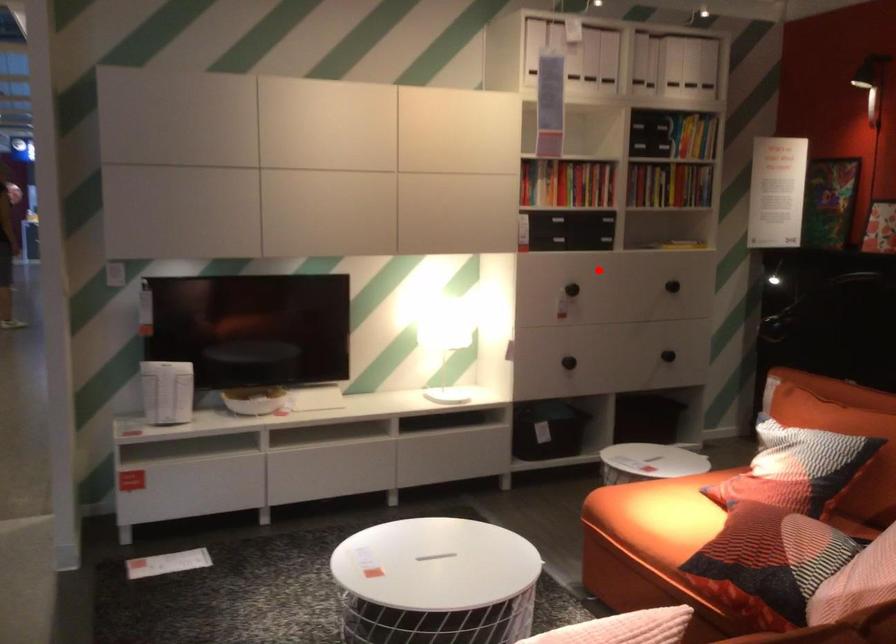
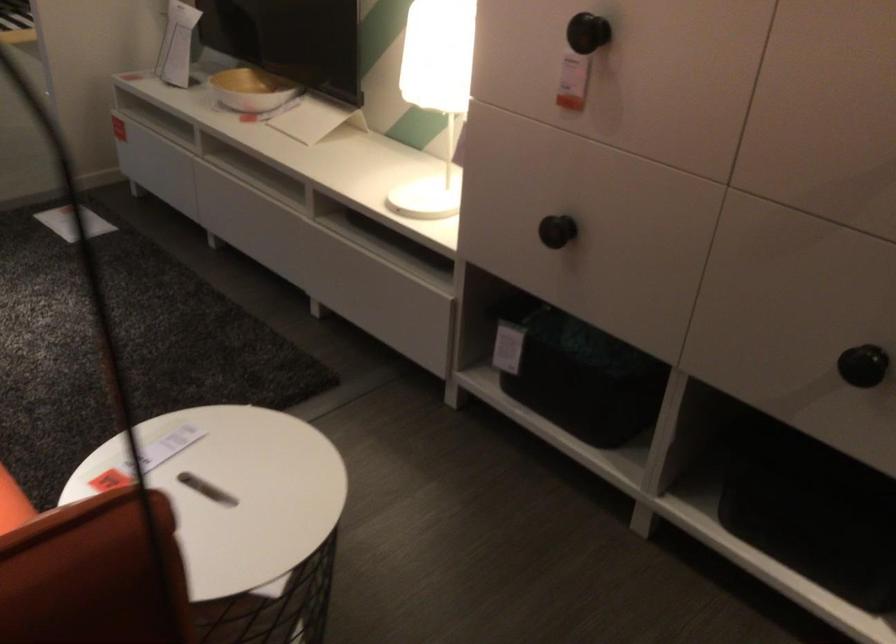
Question: I am providing you with two images of the same scene from different viewpoints. In image1, a red point is highlighted. Considering the same 3D point in image2, which of the following is correct?

Choices:
 (A) It is closer
 (B) It is farther

Answer: (A)